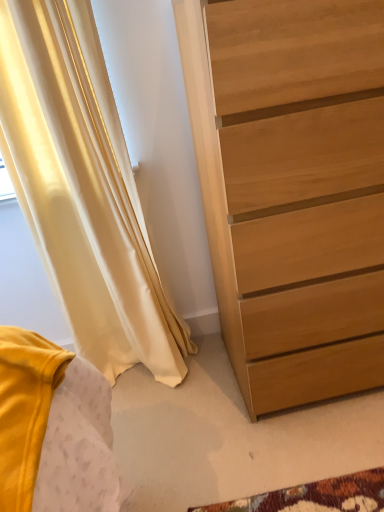
Question: From the image's perspective, is light brown wood chest of drawers at right located above or below satin yellow curtain at left?

Choices:
 (A) above
 (B) below

Answer: (A)

Question: Is light brown wood chest of drawers at right spatially inside satin yellow curtain at left, or outside of it?

Choices:
 (A) outside
 (B) inside

Answer: (A)

Question: From a real-world perspective, is light brown wood chest of drawers at right physically located above or below satin yellow curtain at left?

Choices:
 (A) below
 (B) above

Answer: (A)

Question: Visually, is satin yellow curtain at left positioned to the left or to the right of light brown wood chest of drawers at right?

Choices:
 (A) right
 (B) left

Answer: (B)

Question: Is satin yellow curtain at left taller or shorter than light brown wood chest of drawers at right?

Choices:
 (A) tall
 (B) short

Answer: (A)

Question: In terms of width, does satin yellow curtain at left look wider or thinner when compared to light brown wood chest of drawers at right?

Choices:
 (A) thin
 (B) wide

Answer: (A)

Question: From a real-world perspective, is satin yellow curtain at left positioned above or below light brown wood chest of drawers at right?

Choices:
 (A) below
 (B) above

Answer: (B)